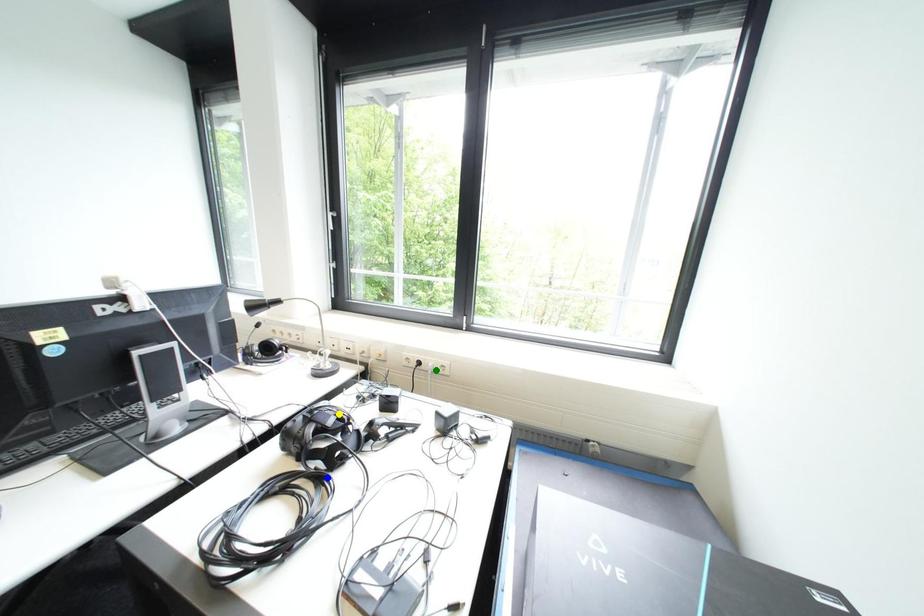
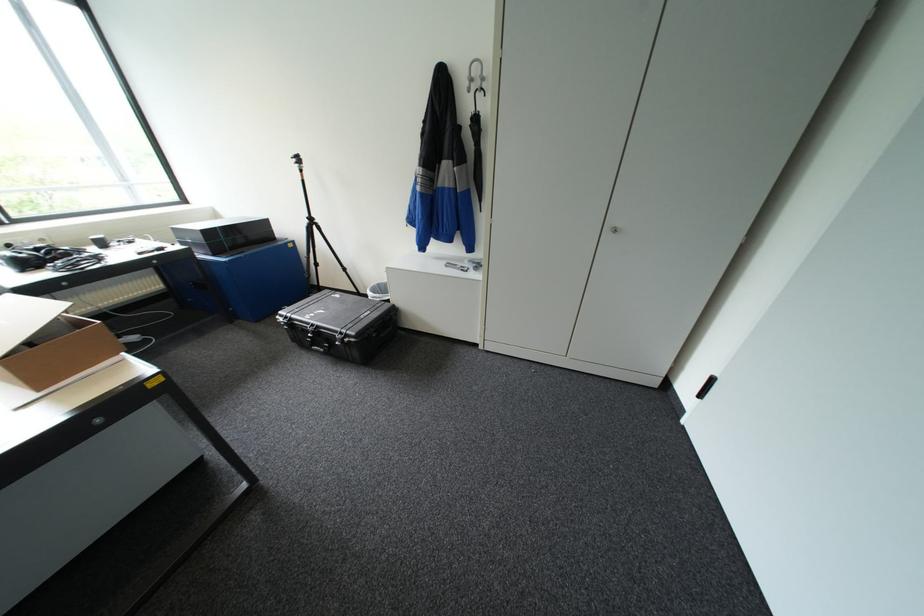
I am providing you with two images of the same scene from different viewpoints. Three points are marked in image1. Which point corresponds to a part or object that is occluded in image2?In image1, three points are marked. Which of them correspond to a part or object that is occluded in image2?Among the three points shown in image1, which one corresponds to a part or object that is no longer visible due to occlusion in image2?

blue point, green point, yellow point cannot be seen in image2.